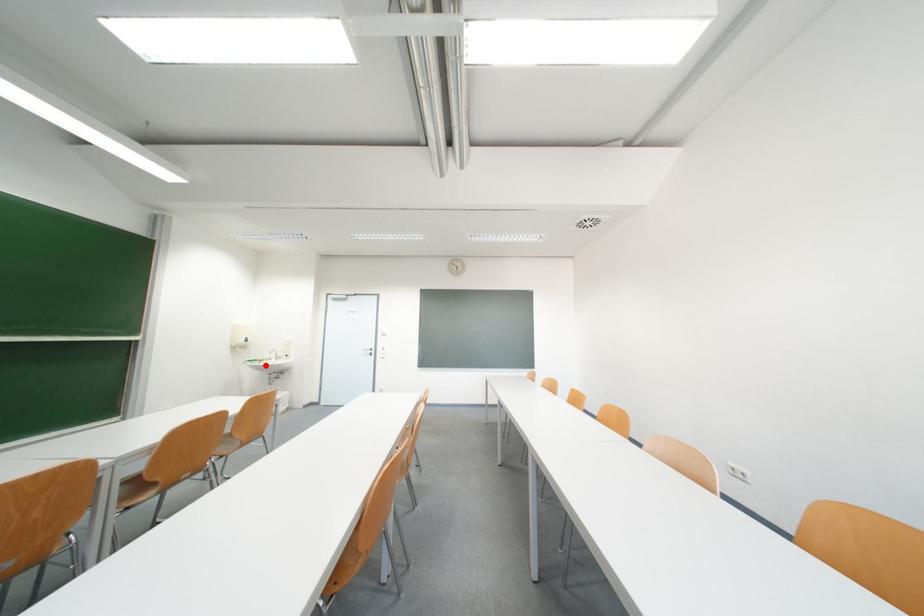
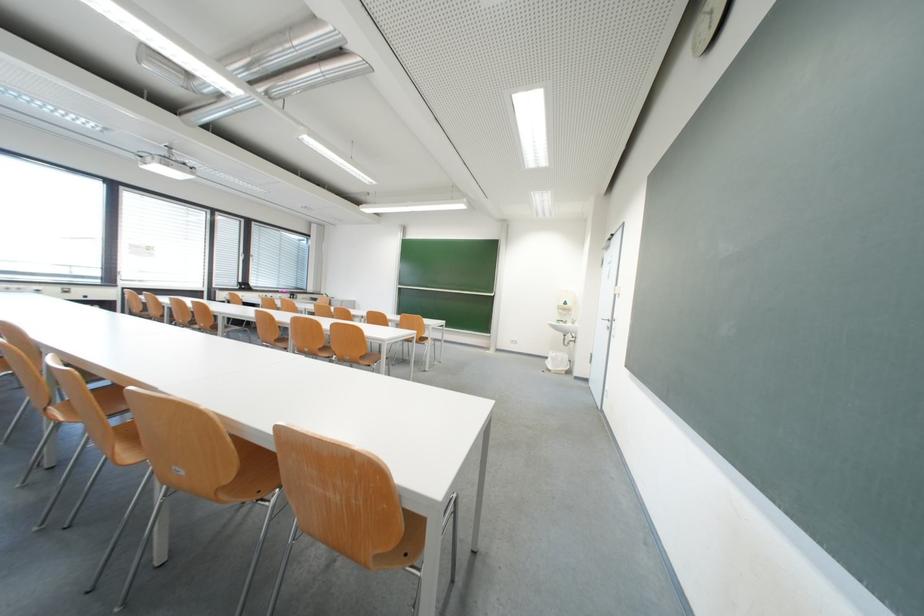
The point at the highlighted location is marked in the first image. Where is the corresponding point in the second image?

(570, 326)